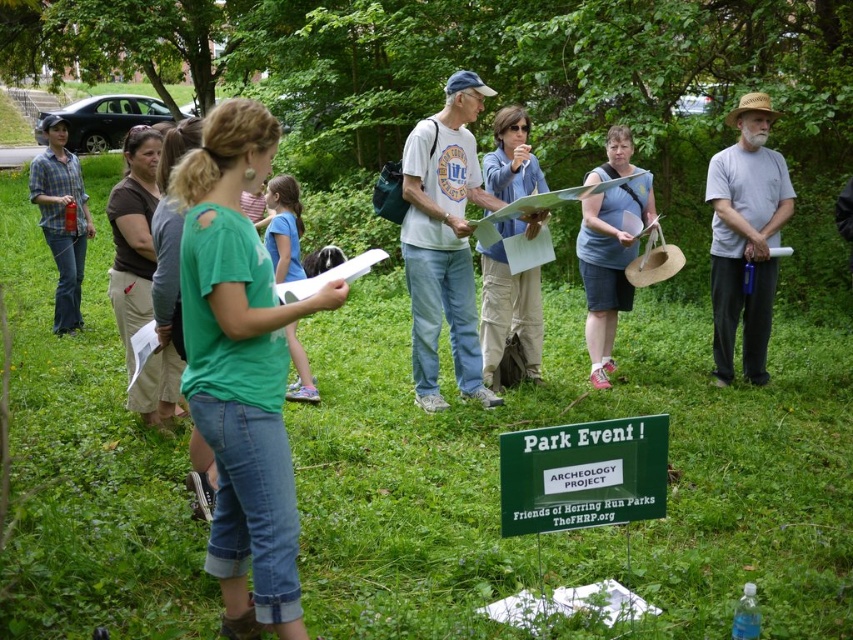
Can you confirm if gray cotton shirt at center is positioned to the left of plaid flannel shirt at left?

In fact, gray cotton shirt at center is to the right of plaid flannel shirt at left.

Between gray cotton shirt at center and plaid flannel shirt at left, which one has less height?

plaid flannel shirt at left is shorter.

What do you see at coordinates (746, 236) in the screenshot?
I see `gray cotton shirt at center` at bounding box center [746, 236].

You are a GUI agent. You are given a task and a screenshot of the screen. Output one action in this format:
    pyautogui.click(x=<x>, y=<y>)
    Task: Click on the gray cotton shirt at center
    This screenshot has width=853, height=640.
    Given the screenshot: What is the action you would take?
    pyautogui.click(x=746, y=236)

Does point (735, 124) lie in front of point (614, 220)?

That is True.

Find the location of `gray cotton shirt at center`. gray cotton shirt at center is located at coordinates (746, 236).

Between point (418, 314) and point (535, 518), which one is positioned behind?

Point (418, 314)

Which is in front, point (482, 106) or point (621, 492)?

Point (621, 492)

Is point (480, 388) closer to viewer compared to point (538, 476)?

No, (480, 388) is further to viewer.

In order to click on white cotton t-shirt at center in this screenshot , I will do `click(444, 241)`.